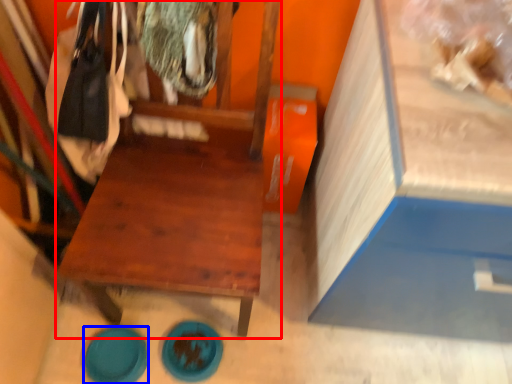
Question: Which of the following is the closest to the observer, furniture (highlighted by a red box) or plate (highlighted by a blue box)?

Choices:
 (A) furniture
 (B) plate

Answer: (A)